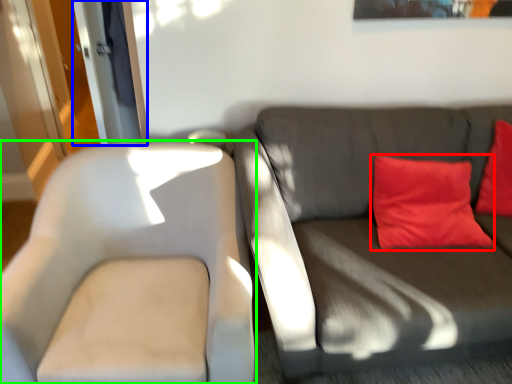
Question: Considering the real-world distances, which object is closest to pillow (highlighted by a red box)? glass door (highlighted by a blue box) or chair (highlighted by a green box).

Choices:
 (A) glass door
 (B) chair

Answer: (B)